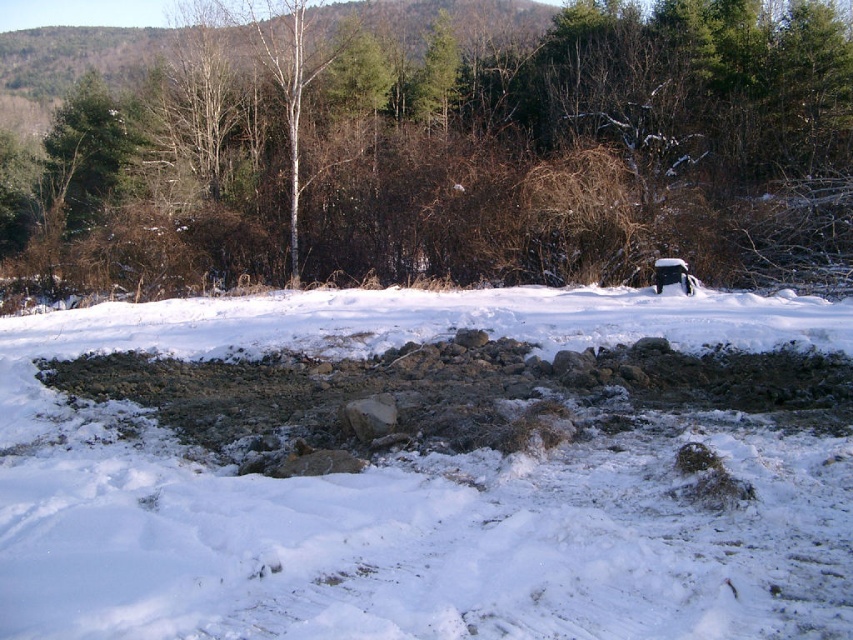
Find the location of `brown bark tree at center`. brown bark tree at center is located at coordinates (436, 147).

Does point (381, 269) come behind point (82, 100)?

That is False.

Find the location of a particular element. brown bark tree at center is located at coordinates (436, 147).

Who is more distant from viewer, [787,348] or [105,168]?

Positioned behind is point [105,168].

Who is higher up, damp gray mud at center or green matte tree at upper left?

green matte tree at upper left

Which is behind, point (634, 381) or point (54, 189)?

Point (54, 189)

Locate an element on the screen. This screenshot has width=853, height=640. damp gray mud at center is located at coordinates (456, 394).

Identify the location of white powdery snow at center. (415, 492).

Find the location of a particular element. white powdery snow at center is located at coordinates (415, 492).